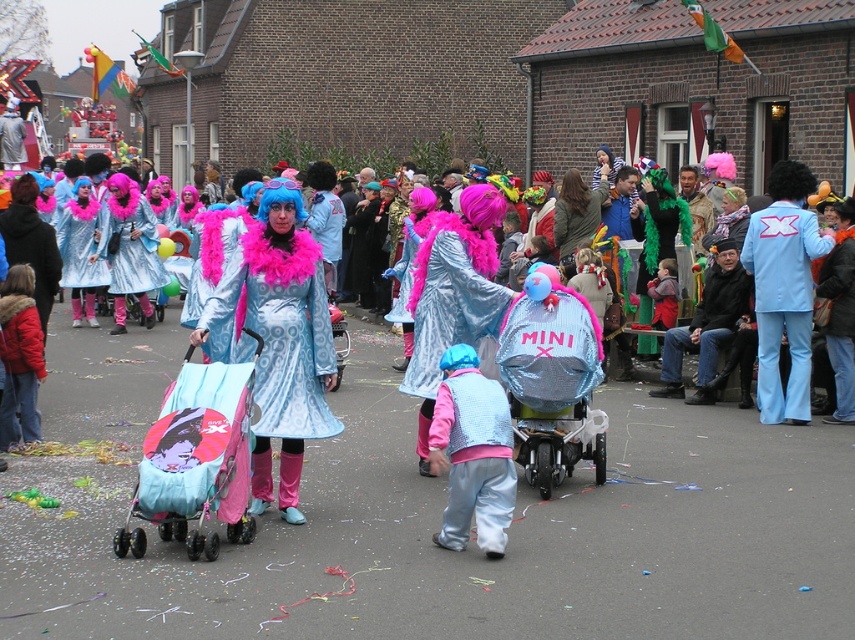
Is point (779, 298) closer to camera compared to point (80, 288)?

Yes.

Locate an element on the screen. Image resolution: width=855 pixels, height=640 pixels. light blue fabric suit at right is located at coordinates (783, 301).

Can you confirm if shiny silver vest at center is positioned below shiny metallic coat at center?

Yes, shiny silver vest at center is below shiny metallic coat at center.

In the scene shown: Between shiny silver vest at center and shiny metallic coat at center, which one appears on the right side from the viewer's perspective?

shiny silver vest at center

Measure the distance between point (491, 429) and camera.

22.69 feet

Where is `shiny silver vest at center`? The width and height of the screenshot is (855, 640). shiny silver vest at center is located at coordinates (x=472, y=452).

In order to click on matte pink fabric baby carriage at center in this screenshot , I will do `click(196, 461)`.

Which is more to the right, matte pink fabric baby carriage at center or shiny silver vest at center?

From the viewer's perspective, shiny silver vest at center appears more on the right side.

Who is more distant from viewer, (164, 497) or (445, 516)?

The point (445, 516) is behind.

Find the location of `matte pink fabric baby carriage at center`. matte pink fabric baby carriage at center is located at coordinates (196, 461).